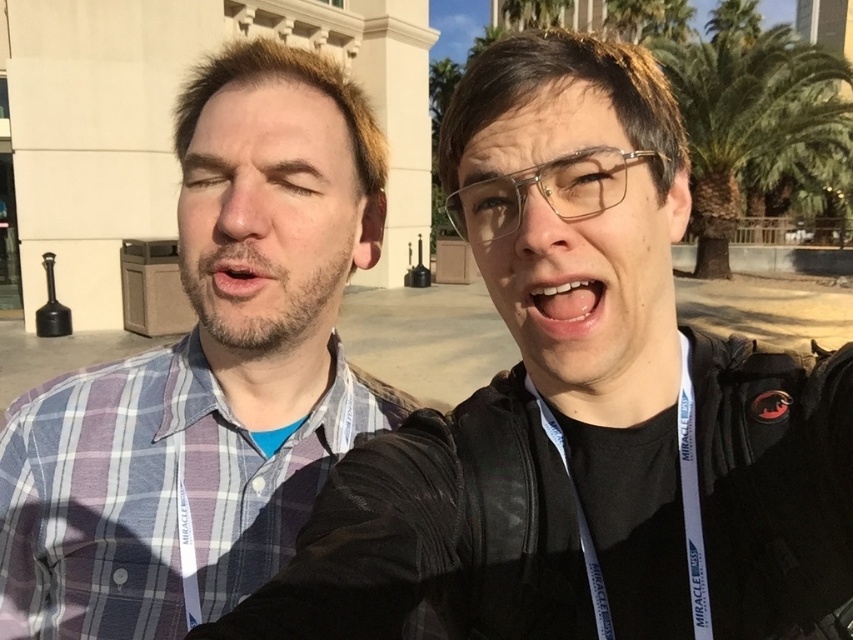
Question: Can you confirm if blue plaid shirt at center is positioned below green leafy palm tree at upper right?

Choices:
 (A) no
 (B) yes

Answer: (B)

Question: Which of these objects is positioned farthest from the white glossy teeth at center?

Choices:
 (A) dry skin at center
 (B) green leafy palm tree at upper right

Answer: (B)

Question: Which is nearer to the blue plaid shirt at center?

Choices:
 (A) white glossy teeth at center
 (B) green leafy palm tree at upper right
 (C) dry skin at center

Answer: (C)

Question: Is blue plaid shirt at center below white glossy teeth at center?

Choices:
 (A) yes
 (B) no

Answer: (A)

Question: Can you confirm if green leafy palm tree at upper right is positioned below dry skin at center?

Choices:
 (A) yes
 (B) no

Answer: (B)

Question: Which object is farther from the camera taking this photo?

Choices:
 (A) dry skin at center
 (B) green leafy palm tree at upper right

Answer: (B)